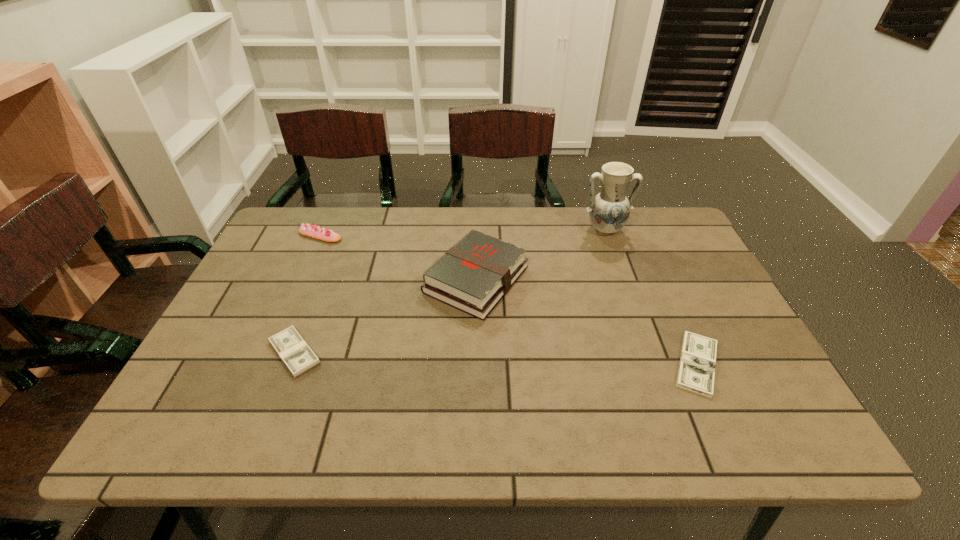
Image resolution: width=960 pixels, height=540 pixels. Identify the location of free spot that satisfies the following two spatial constraints: 1. on the front side of the shorter dollar; 2. on the left side of the third shortest object. (263, 364).

I want to click on free space in the image that satisfies the following two spatial constraints: 1. on either side of the shortest object; 2. on the right side of the tallest object, so click(653, 364).